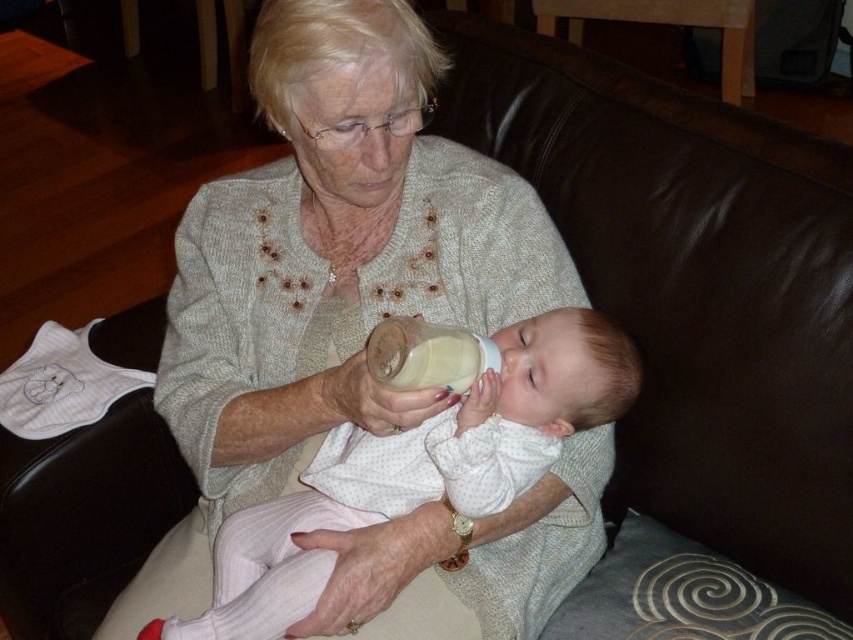
Does point (228, 525) come closer to viewer compared to point (463, 392)?

That is False.

Does white cotton baby at center have a greater width compared to translucent plastic bottle at center?

Correct, the width of white cotton baby at center exceeds that of translucent plastic bottle at center.

Does point (457, 506) come in front of point (482, 355)?

No, it is not.

At what (x,y) coordinates should I click in order to perform the action: click on white cotton baby at center. Please return your answer as a coordinate pair (x, y). The height and width of the screenshot is (640, 853). Looking at the image, I should click on (418, 468).